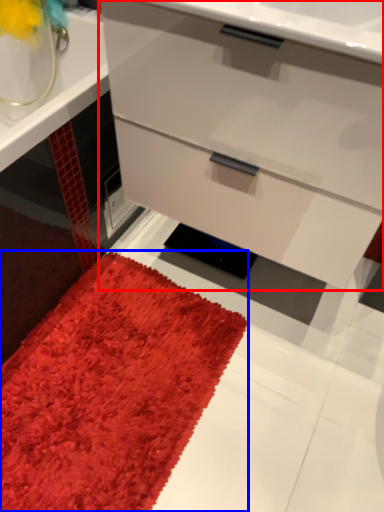
Question: Among these objects, which one is nearest to the camera, chest of drawers (highlighted by a red box) or mat (highlighted by a blue box)?

Choices:
 (A) chest of drawers
 (B) mat

Answer: (A)